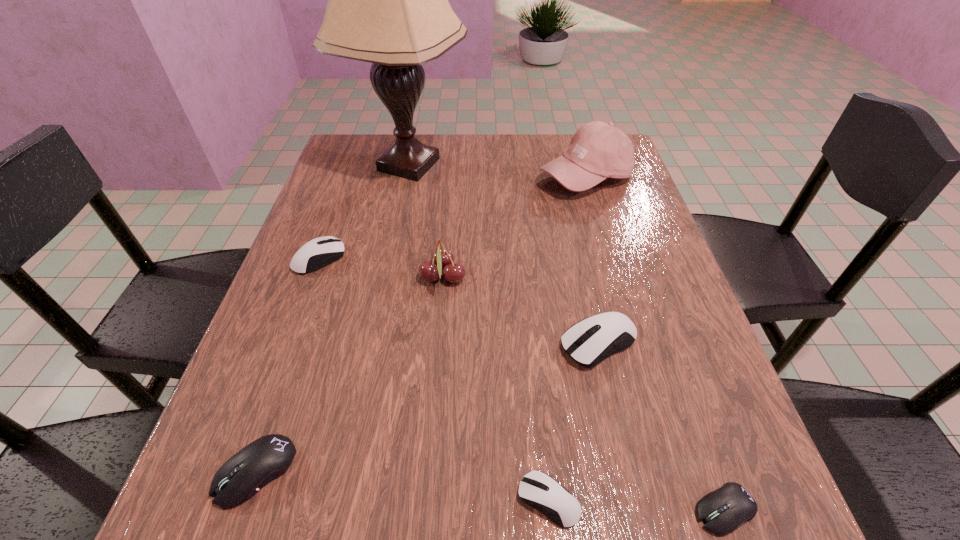
This screenshot has width=960, height=540. I want to click on the bigger black computer equipment, so click(x=262, y=461).

You are a GUI agent. You are given a task and a screenshot of the screen. Output one action in this format:
    pyautogui.click(x=<x>, y=<y>)
    Task: Click on the third computer equipment from right to left
    
    Given the screenshot: What is the action you would take?
    pyautogui.click(x=537, y=489)

Where is `the smallest white mouse`? This screenshot has height=540, width=960. the smallest white mouse is located at coordinates (537, 489).

At what (x,y) coordinates should I click in order to perform the action: click on the smaller black computer equipment. Please return your answer as a coordinate pair (x, y). This screenshot has height=540, width=960. Looking at the image, I should click on (723, 510).

Find the location of a particular element. the right black computer equipment is located at coordinates (723, 510).

The width and height of the screenshot is (960, 540). In order to click on vacant space situated 0.350m on the front of the beige lamp in this screenshot , I will do `click(379, 307)`.

This screenshot has height=540, width=960. In order to click on blank space located on the front-facing side of the seventh shortest object in this screenshot , I will do `click(598, 218)`.

I want to click on vacant space positioned on the leaves of the cherry, so click(505, 277).

Identify the location of free location located 0.070m on the front of the rightmost white mouse. (614, 409).

Where is `vacant area situated on the back of the farthest computer equipment`? The image size is (960, 540). vacant area situated on the back of the farthest computer equipment is located at coordinates click(x=331, y=225).